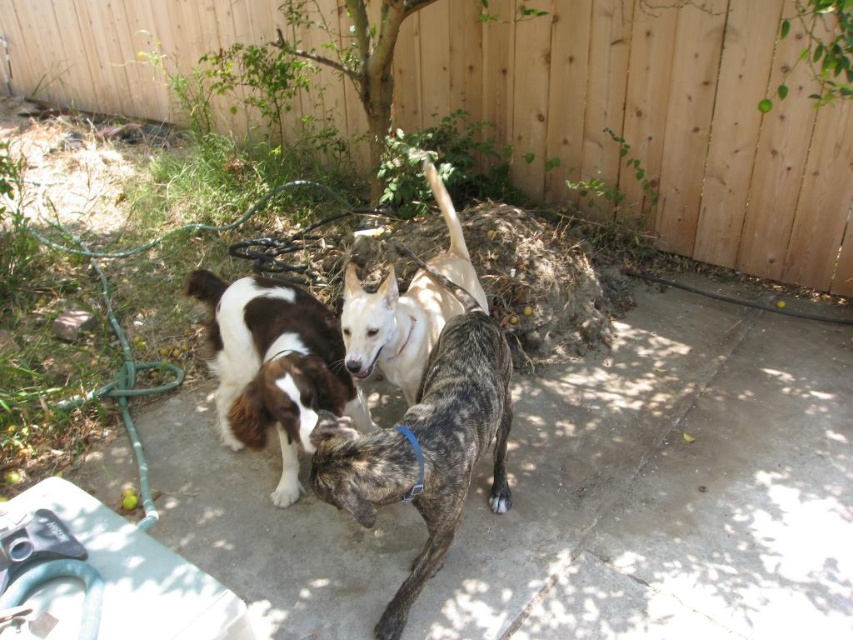
Is point (474, 65) farther from camera compared to point (440, 308)?

Yes, point (474, 65) is behind point (440, 308).

Does wooden fence at upper center have a lesser width compared to white smooth dog at center?

In fact, wooden fence at upper center might be wider than white smooth dog at center.

Does point (628, 26) come farther from viewer compared to point (379, 316)?

That is True.

Where is `wooden fence at upper center`? This screenshot has height=640, width=853. wooden fence at upper center is located at coordinates (653, 120).

Consider the image. Does brindle fur dog at center appear over brown and white fur at center?

No, brindle fur dog at center is not above brown and white fur at center.

Is brindle fur dog at center thinner than brown and white fur at center?

Yes.

Is point (428, 506) less distant than point (300, 353)?

Yes, point (428, 506) is in front of point (300, 353).

Find the location of `brindle fur dog at center`. brindle fur dog at center is located at coordinates (426, 445).

Which is above, wooden fence at upper center or brindle fur dog at center?

wooden fence at upper center is higher up.

Does point (695, 173) come farther from viewer compared to point (432, 369)?

Yes, point (695, 173) is farther from viewer.

Between point (740, 45) and point (370, 440), which one is positioned behind?

The point (740, 45) is behind.

Identify the location of wooden fence at upper center. This screenshot has height=640, width=853. (653, 120).